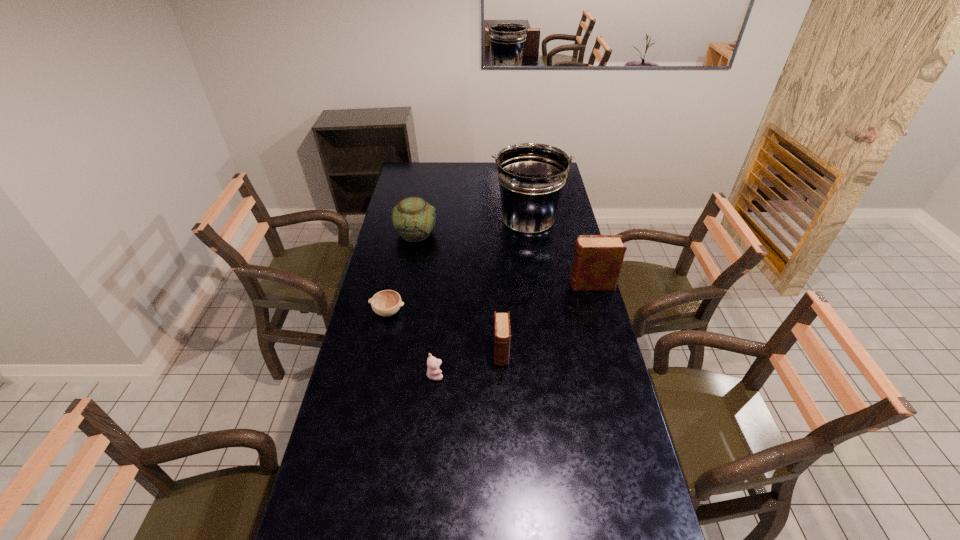
Locate an element on the screen. vacant space located 0.200m on the spine side of the shorter diary is located at coordinates (504, 420).

Locate an element on the screen. vacant space situated 0.050m on the spine side of the right diary is located at coordinates (556, 285).

Identify the location of blank space located 0.230m on the spine side of the right diary. This screenshot has height=540, width=960. (513, 285).

At what (x,y) coordinates should I click in order to perform the action: click on blank space located 0.240m on the spine side of the right diary. Please return your answer as a coordinate pair (x, y). Image resolution: width=960 pixels, height=540 pixels. Looking at the image, I should click on (511, 285).

The width and height of the screenshot is (960, 540). Identify the location of vacant space located 0.250m on the right of the pottery. (491, 233).

Identify the location of vacant space located 0.120m on the left of the bucket. Image resolution: width=960 pixels, height=540 pixels. (466, 223).

This screenshot has height=540, width=960. What are the coordinates of `free space located on the back of the shortest object` in the screenshot? It's located at (398, 262).

Where is `free space located 0.220m at the face of the third object from left to right`? free space located 0.220m at the face of the third object from left to right is located at coordinates (x=509, y=374).

You are a GUI agent. You are given a task and a screenshot of the screen. Output one action in this format:
    pyautogui.click(x=<x>, y=<y>)
    Task: Click on the pottery that is positioned at the left edge
    
    Given the screenshot: What is the action you would take?
    pyautogui.click(x=413, y=218)

In order to click on bowl that is at the left edge in this screenshot , I will do `click(386, 303)`.